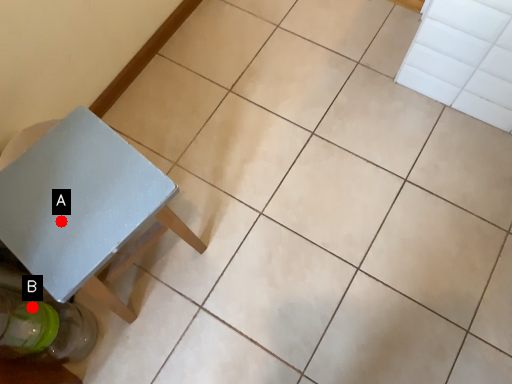
Question: Two points are circled on the image, labeled by A and B beside each circle. Which point is closer to the camera?

Choices:
 (A) A is closer
 (B) B is closer

Answer: (A)